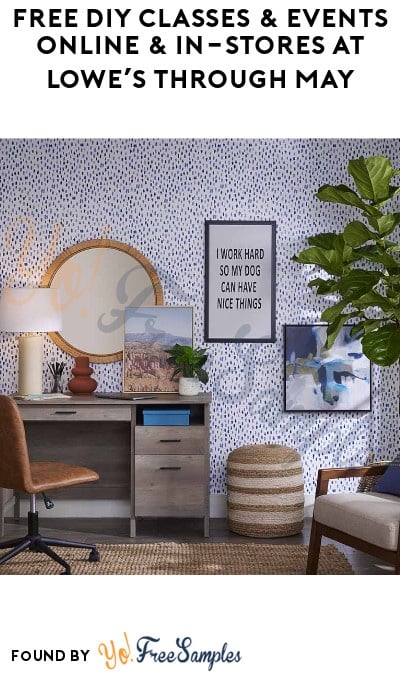
You are a GUI agent. You are given a task and a screenshot of the screen. Output one action in this format:
    pyautogui.click(x=<x>, y=<y>)
    Task: Click on the drawers
    The width and height of the screenshot is (400, 675).
    Given the screenshot: What is the action you would take?
    pyautogui.click(x=173, y=491), pyautogui.click(x=183, y=446), pyautogui.click(x=89, y=410)